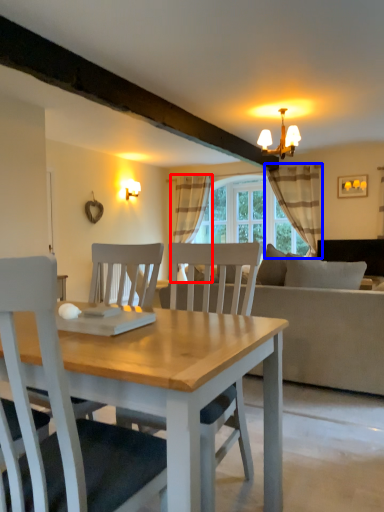
Question: Which point is further to the camera, curtain (highlighted by a red box) or curtain (highlighted by a blue box)?

Choices:
 (A) curtain
 (B) curtain

Answer: (A)